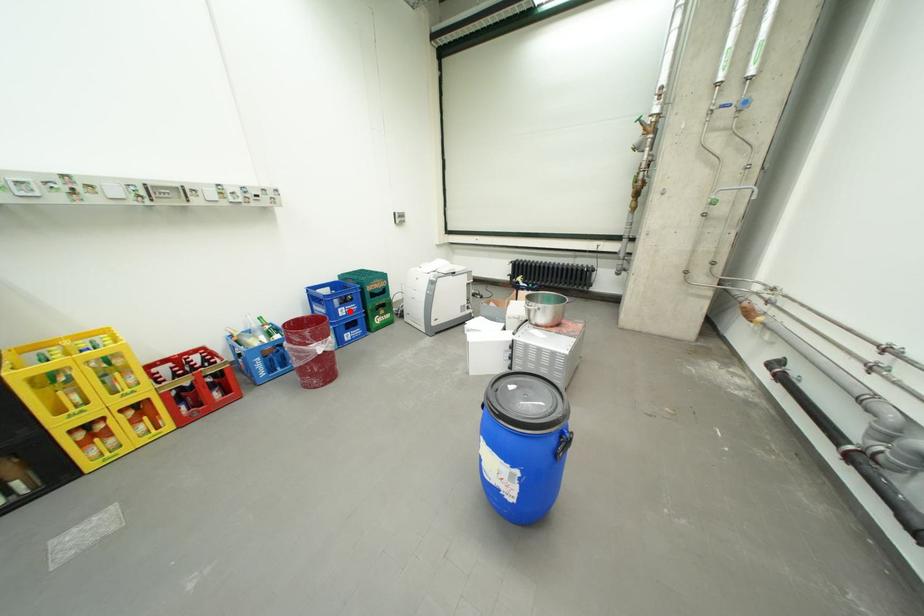
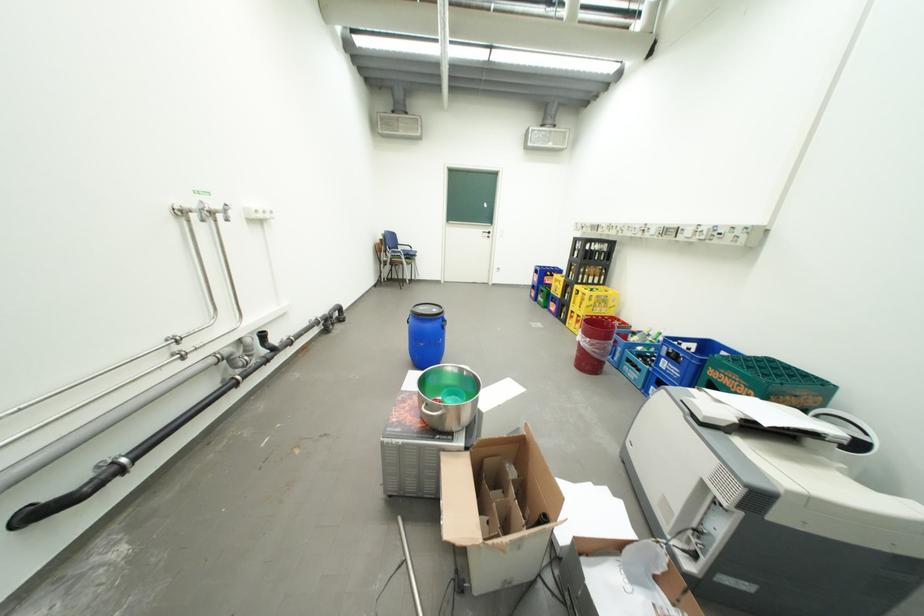
Question: I am providing you with two images of the same scene from different viewpoints. A red point is shown in image1. For the corresponding object point in image2, is it positioned nearer or farther from the camera?

Choices:
 (A) Nearer
 (B) Farther

Answer: (A)